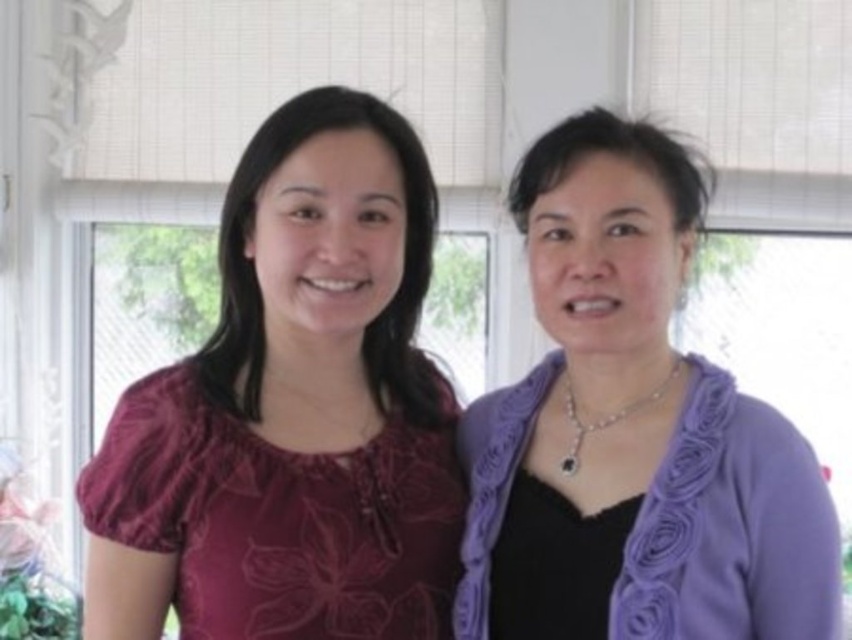
Does point (327, 544) lie in front of point (658, 173)?

Yes, point (327, 544) is in front of point (658, 173).

Does matte floral blouse at center appear over purple fabric at right?

Yes, matte floral blouse at center is above purple fabric at right.

Is point (329, 228) positioned behind point (583, 580)?

Yes, point (329, 228) is behind point (583, 580).

Find the location of a particular element. This screenshot has width=852, height=640. matte floral blouse at center is located at coordinates (301, 403).